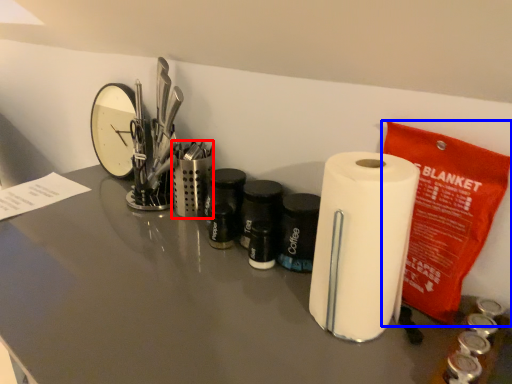
Question: Which of the following is the farthest to the observer, stationery (highlighted by a red box) or stationery (highlighted by a blue box)?

Choices:
 (A) stationery
 (B) stationery

Answer: (A)